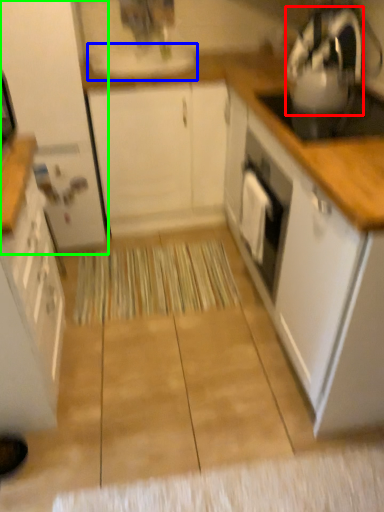
Question: Estimate the real-world distances between objects in this image. Which object is closer to kitchen appliance (highlighted by a red box), sink (highlighted by a blue box) or cabinetry (highlighted by a green box)?

Choices:
 (A) sink
 (B) cabinetry

Answer: (A)